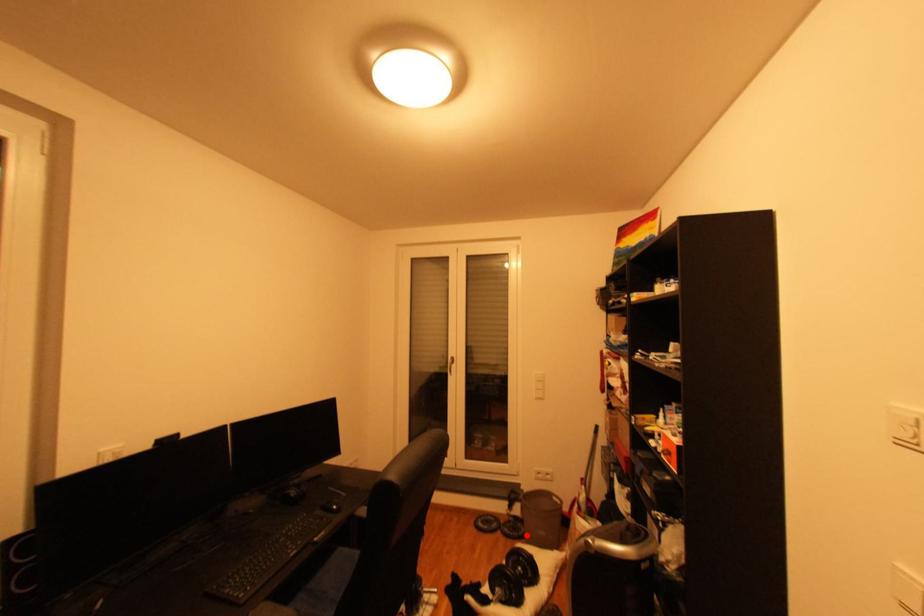
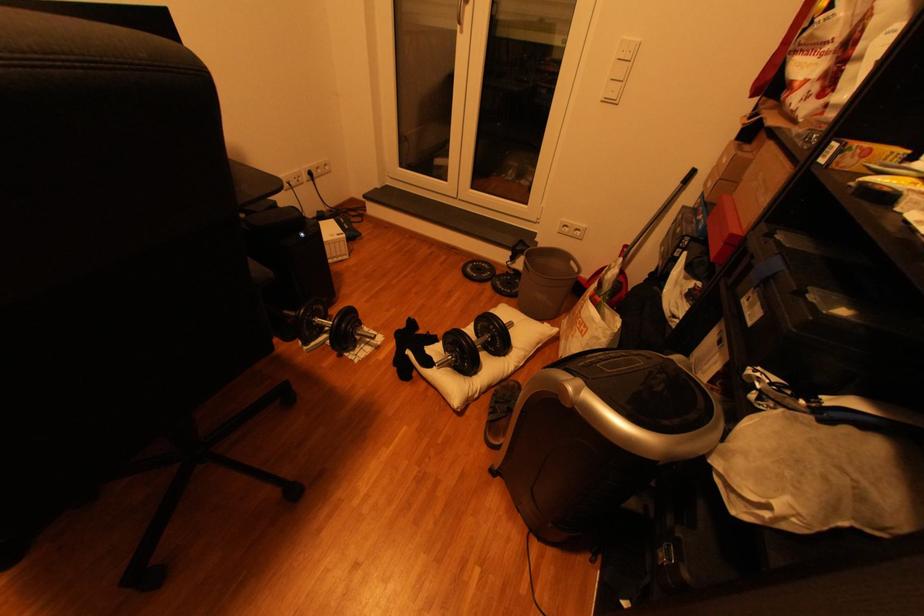
Question: I am providing you with two images of the same scene from different viewpoints. In image1, a red point is highlighted. Considering the same 3D point in image2, which of the following is correct?

Choices:
 (A) It is closer
 (B) It is farther

Answer: (A)